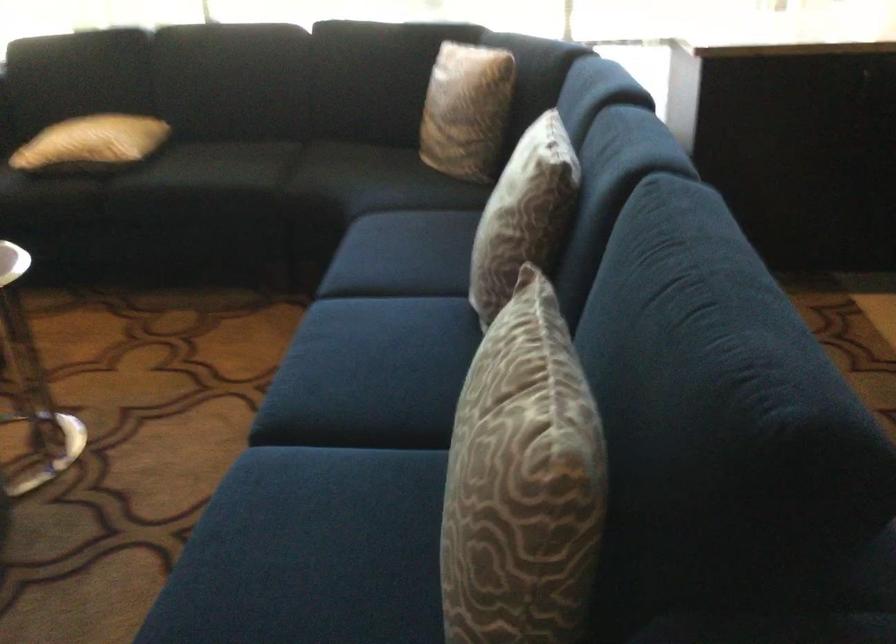
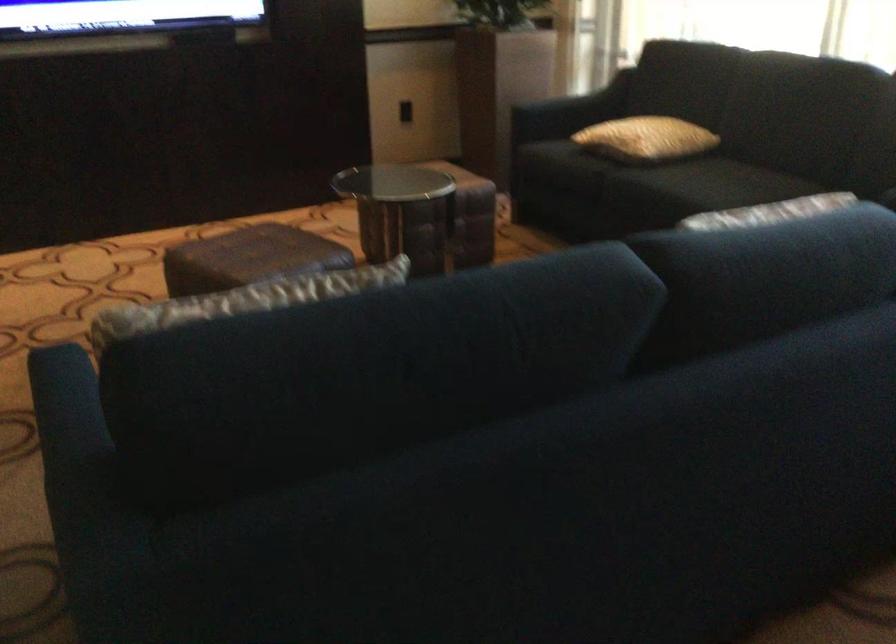
Locate, in the second image, the point that corresponds to pixel 554 346 in the first image.

(252, 298)